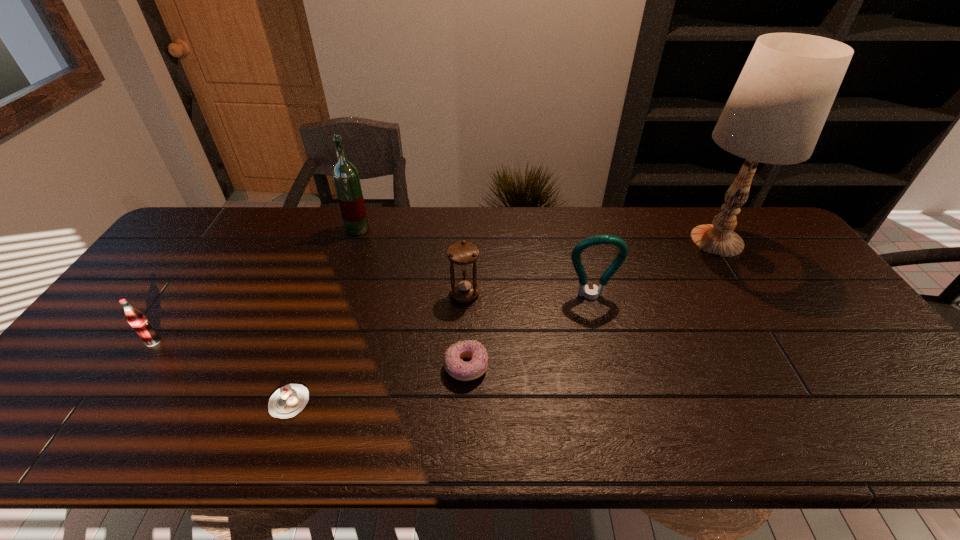
At what (x,y) coordinates should I click in order to perform the action: click on the tallest object. Please return your answer as a coordinate pair (x, y). This screenshot has width=960, height=540. Looking at the image, I should click on (775, 114).

Identify the location of the rightmost object. (775, 114).

Identify the location of the sixth shortest object. Image resolution: width=960 pixels, height=540 pixels. (345, 175).

You are a GUI agent. You are given a task and a screenshot of the screen. Output one action in this format:
    pyautogui.click(x=<x>, y=<y>)
    Task: Click on the bottle opener
    
    Given the screenshot: What is the action you would take?
    pyautogui.click(x=591, y=294)

Where is `the second object from right to left`? This screenshot has height=540, width=960. the second object from right to left is located at coordinates (591, 294).

Locate an element on the screen. hourglass is located at coordinates point(462,254).

This screenshot has width=960, height=540. In order to click on the third nearest object in this screenshot , I will do `click(137, 320)`.

Where is `soda bottle`? soda bottle is located at coordinates (137, 320).

This screenshot has width=960, height=540. What are the coordinates of `doughnut` in the screenshot? It's located at (454, 365).

At what (x,y) coordinates should I click in order to perform the action: click on the shortest object. Please return your answer as a coordinate pair (x, y). The height and width of the screenshot is (540, 960). Looking at the image, I should click on [x=288, y=401].